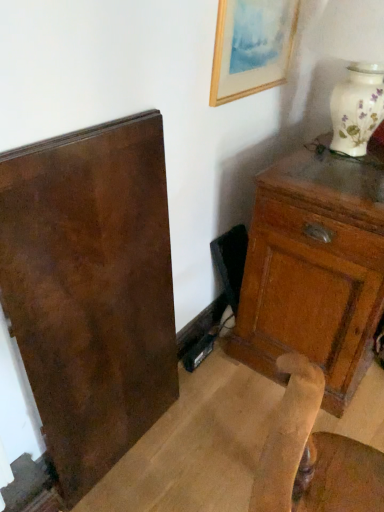
Question: From a real-world perspective, is wooden framed painting at upper right beneath matte brown cabinet at right?

Choices:
 (A) no
 (B) yes

Answer: (A)

Question: Is wooden framed painting at upper right far away from matte brown cabinet at right?

Choices:
 (A) no
 (B) yes

Answer: (A)

Question: Is wooden framed painting at upper right to the right of matte brown cabinet at right from the viewer's perspective?

Choices:
 (A) yes
 (B) no

Answer: (B)

Question: From the image's perspective, is wooden framed painting at upper right under matte brown cabinet at right?

Choices:
 (A) no
 (B) yes

Answer: (A)

Question: Considering the relative sizes of wooden framed painting at upper right and matte brown cabinet at right in the image provided, is wooden framed painting at upper right bigger than matte brown cabinet at right?

Choices:
 (A) no
 (B) yes

Answer: (A)

Question: Is wooden framed painting at upper right completely or partially outside of matte brown cabinet at right?

Choices:
 (A) no
 (B) yes

Answer: (B)

Question: From a real-world perspective, is matte brown cabinet at right positioned under wooden framed painting at upper right based on gravity?

Choices:
 (A) no
 (B) yes

Answer: (B)

Question: From the image's perspective, does matte brown cabinet at right appear higher than wooden framed painting at upper right?

Choices:
 (A) no
 (B) yes

Answer: (A)

Question: Is matte brown cabinet at right positioned with its back to wooden framed painting at upper right?

Choices:
 (A) yes
 (B) no

Answer: (B)

Question: From the image's perspective, is matte brown cabinet at right below wooden framed painting at upper right?

Choices:
 (A) no
 (B) yes

Answer: (B)

Question: Is matte brown cabinet at right surrounding wooden framed painting at upper right?

Choices:
 (A) yes
 (B) no

Answer: (B)

Question: Is matte brown cabinet at right not close to wooden framed painting at upper right?

Choices:
 (A) no
 (B) yes

Answer: (A)

Question: Considering the positions of matte brown cabinet at right and wooden framed painting at upper right in the image, is matte brown cabinet at right wider or thinner than wooden framed painting at upper right?

Choices:
 (A) thin
 (B) wide

Answer: (B)